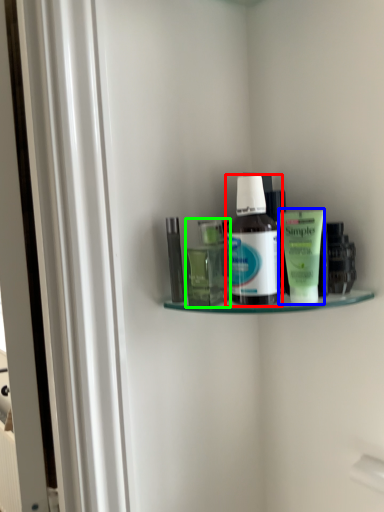
Question: Which object is positioned closest to bottle (highlighted by a red box)? Select from toiletry (highlighted by a blue box) and toiletry (highlighted by a green box).

Choices:
 (A) toiletry
 (B) toiletry

Answer: (A)